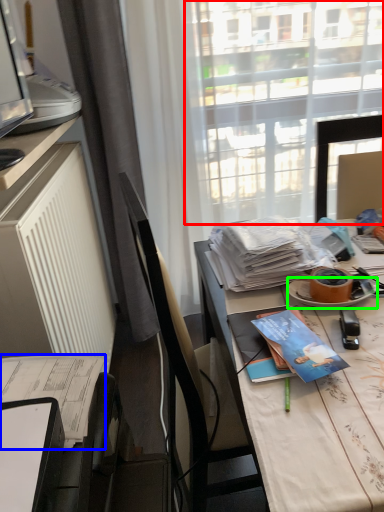
Question: Which is farther away from window screen (highlighted by a red box)? journal (highlighted by a blue box) or plate (highlighted by a green box)?

Choices:
 (A) journal
 (B) plate

Answer: (A)